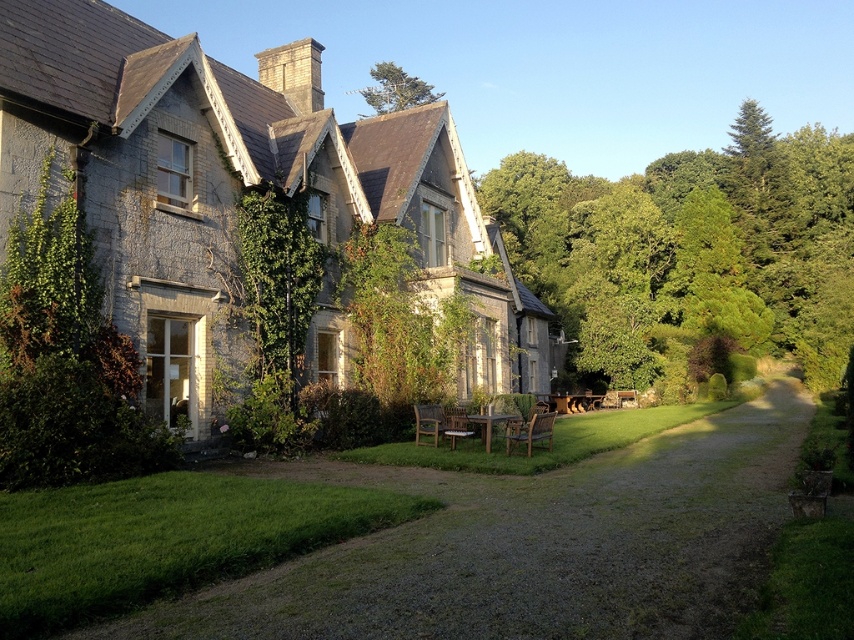
You are planning to install a new garden light between the green leafy tree at right and the green leafy tree at upper center. Which tree should the light be closer to if you want it to illuminate the smaller tree more effectively?

The green leafy tree at upper center is smaller, so the light should be placed closer to it to ensure better illumination.

You are standing on the gravel path leading to the stone cottage at center and the green leafy tree at center. Which object is closer to you as you approach the house?

The green leafy tree at center is closer to you because the stone cottage at center is positioned over it, indicating that the tree is in front of the cottage.

You are planning to install a new satellite dish on the highest point between the stone cottage at center and the green leafy tree at center. Which structure should you choose for installation?

The stone cottage at center has a greater height compared to the green leafy tree at center, so you should install the satellite dish on the stone cottage at center.